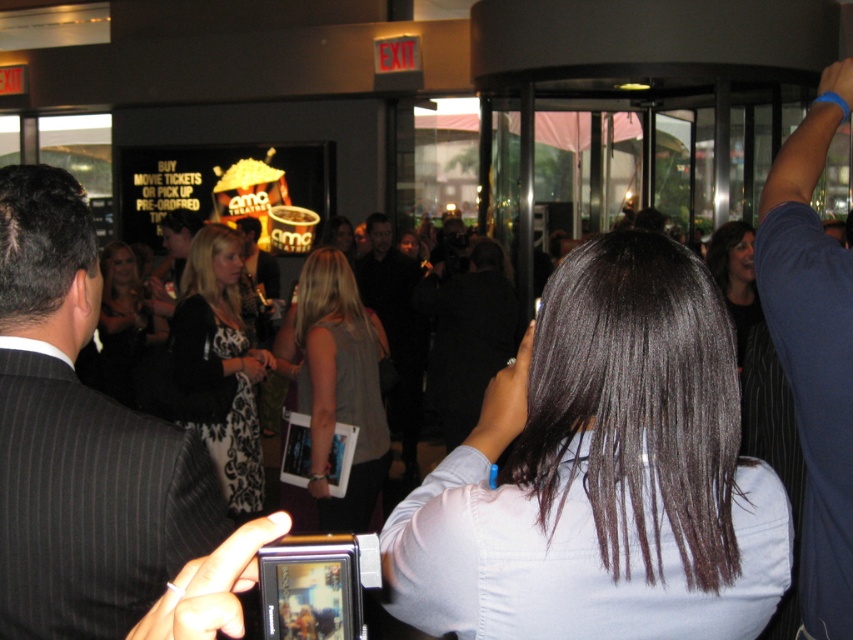
Question: Which object is positioned closest to the dark gray pinstripe suit at left?

Choices:
 (A) dark brown hair at center
 (B) black dress at center

Answer: (A)

Question: Which of the following is the farthest from the observer?

Choices:
 (A) dark brown hair at center
 (B) gray fabric tank top at center
 (C) black dress at center
 (D) blue fabric arm at upper right

Answer: (C)

Question: Can you confirm if dark brown hair at center is positioned below dark gray pinstripe suit at left?

Choices:
 (A) yes
 (B) no

Answer: (A)

Question: Does dark gray pinstripe suit at left have a lesser width compared to black damask dress at center?

Choices:
 (A) yes
 (B) no

Answer: (A)

Question: Is dark brown hair at center to the left of gray fabric tank top at center from the viewer's perspective?

Choices:
 (A) no
 (B) yes

Answer: (A)

Question: Which point is closer to the camera?

Choices:
 (A) (53, 531)
 (B) (318, 438)
 (C) (244, 433)

Answer: (A)